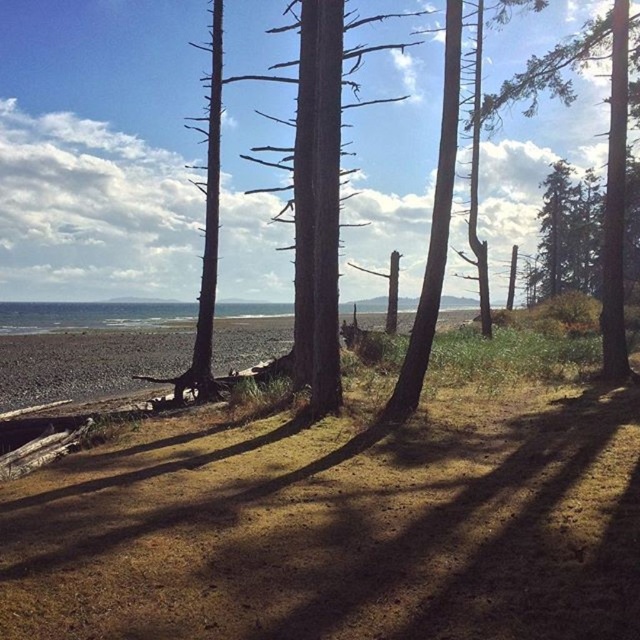
Does brown sandy beach at lower left appear on the right side of green textured tree at center?

In fact, brown sandy beach at lower left is to the left of green textured tree at center.

Between brown sandy beach at lower left and green textured tree at center, which one is positioned higher?

Positioned higher is green textured tree at center.

What do you see at coordinates (88, 360) in the screenshot?
I see `brown sandy beach at lower left` at bounding box center [88, 360].

The height and width of the screenshot is (640, 640). In order to click on brown sandy beach at lower left in this screenshot , I will do `click(88, 360)`.